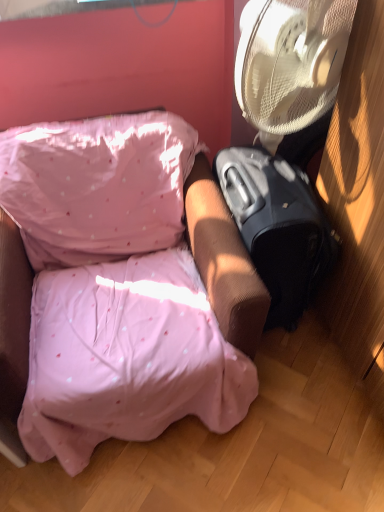
Question: From a real-world perspective, relative to black matte suitcase at right, is pink fabric couch at center vertically above or below?

Choices:
 (A) below
 (B) above

Answer: (B)

Question: From their relative heights in the image, would you say pink fabric couch at center is taller or shorter than black matte suitcase at right?

Choices:
 (A) short
 (B) tall

Answer: (B)

Question: Would you say pink fabric couch at center is to the left or to the right of black matte suitcase at right in the picture?

Choices:
 (A) right
 (B) left

Answer: (B)

Question: From the image's perspective, is black matte suitcase at right located above or below pink fabric couch at center?

Choices:
 (A) below
 (B) above

Answer: (B)

Question: Looking at the image, does black matte suitcase at right seem bigger or smaller compared to pink fabric couch at center?

Choices:
 (A) small
 (B) big

Answer: (A)

Question: Is black matte suitcase at right situated inside pink fabric couch at center or outside?

Choices:
 (A) inside
 (B) outside

Answer: (B)

Question: Is black matte suitcase at right in front of or behind pink fabric couch at center in the image?

Choices:
 (A) behind
 (B) front

Answer: (A)